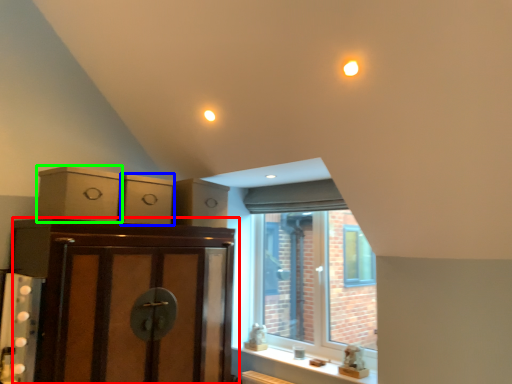
Question: Which object is the closest to the cabinetry (highlighted by a red box)? Choose among these: cabinetry (highlighted by a blue box) or cabinetry (highlighted by a green box).

Choices:
 (A) cabinetry
 (B) cabinetry

Answer: (B)